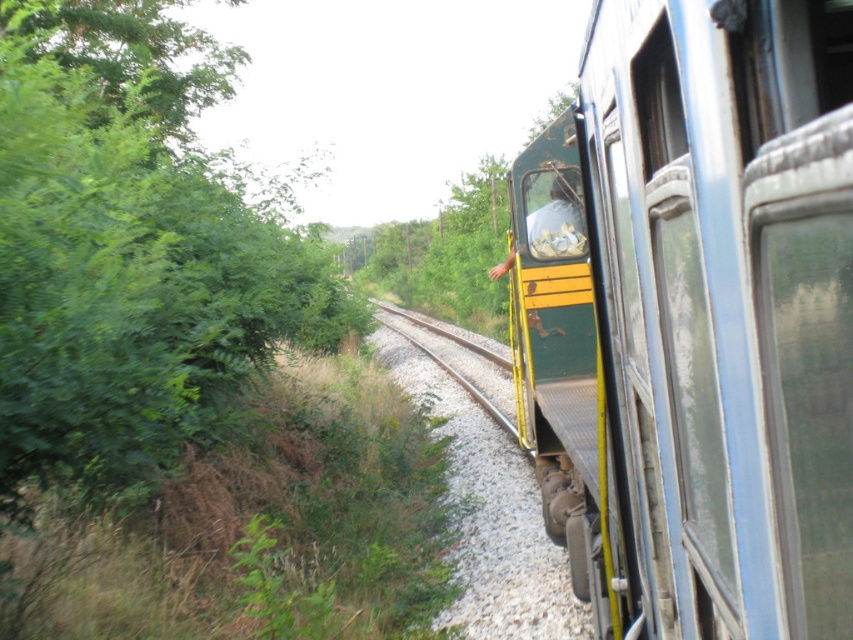
Is green matte train at center in front of green leafy tree at left?

That is True.

What do you see at coordinates (718, 316) in the screenshot?
I see `green matte train at center` at bounding box center [718, 316].

I want to click on green matte train at center, so click(718, 316).

Is point (577, 216) closer to viewer compared to point (450, 365)?

Yes, point (577, 216) is closer to viewer.

Which is behind, point (572, 218) or point (415, 317)?

Positioned behind is point (415, 317).

The image size is (853, 640). What are the coordinates of `clear glass window at center` in the screenshot? It's located at (558, 218).

Does green leafy tree at left have a smaller size compared to clear glass window at center?

No, green leafy tree at left is not smaller than clear glass window at center.

Between green leafy tree at left and clear glass window at center, which one has less height?

With less height is clear glass window at center.

Find the location of a particular element. The image size is (853, 640). green leafy tree at left is located at coordinates (131, 248).